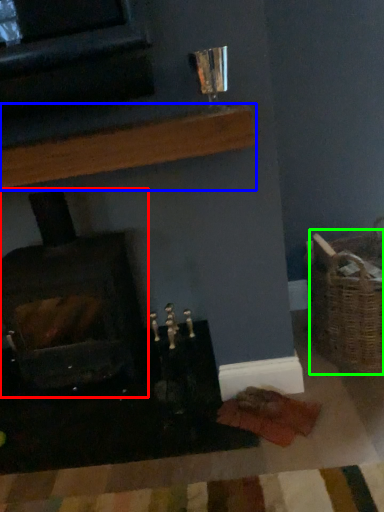
Question: Which object is the farthest from wood burning stove (highlighted by a red box)? Choose among these: shelf (highlighted by a blue box) or basket (highlighted by a green box).

Choices:
 (A) shelf
 (B) basket

Answer: (B)